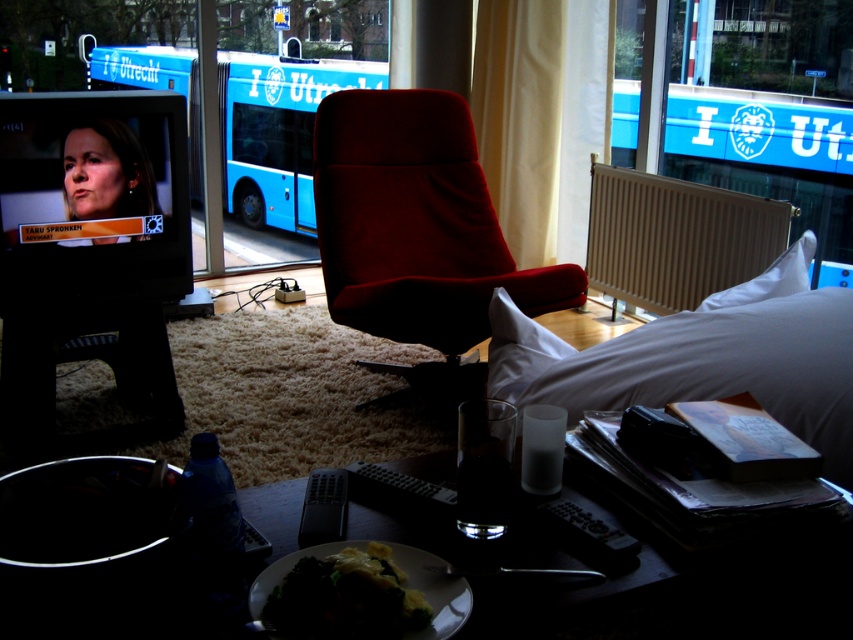
You are a guest in this hotel room and want to place a small plant on the floor between the white matte bed at lower right and the green leafy vegetables at lower center. Considering their heights, which object should the plant be placed closer to?

The white matte bed at lower right is taller than the green leafy vegetables at lower center, so the plant should be placed closer to the green leafy vegetables at lower center to ensure visibility from the bed.

Consider the image. You are a guest in this hotel room and want to place a small lamp between the white matte bed at lower right and the white soft pillow at upper right. Based on their positions, which object should the lamp be closer to?

The white matte bed at lower right is positioned on the left side of white soft pillow at upper right, so the lamp should be placed closer to the white soft pillow at upper right to maintain symmetry between the two objects.